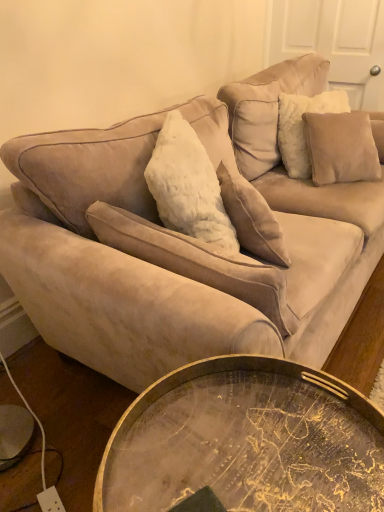
The image size is (384, 512). Describe the element at coordinates (303, 127) in the screenshot. I see `suede beige pillow at upper right, the second pillow from the right` at that location.

Locate an element on the screen. suede beige pillow at upper right, the second pillow viewed from the left is located at coordinates (303, 127).

Describe the element at coordinates (341, 147) in the screenshot. The width and height of the screenshot is (384, 512). I see `suede beige pillow at upper right, which is the 3th pillow from left to right` at that location.

Find the location of `suede beige couch at upper center`. suede beige couch at upper center is located at coordinates (188, 240).

At what (x,y) coordinates should I click in order to perform the action: click on gold metallic tray at lower center. Please return your answer as a coordinate pair (x, y). Looking at the image, I should click on (246, 441).

Does point (261, 211) come in front of point (234, 257)?

No, it is not.

Between white fluffy pillow at center, marked as the 1th pillow in a front-to-back arrangement, and suede beige couch at upper center, which one has less height?

Standing shorter between the two is white fluffy pillow at center, marked as the 1th pillow in a front-to-back arrangement.

Considering the positions of objects white fluffy pillow at center, the third pillow viewed from the back, and suede beige couch at upper center in the image provided, who is in front, white fluffy pillow at center, the third pillow viewed from the back, or suede beige couch at upper center?

suede beige couch at upper center is closer to the camera.

Is white fluffy pillow at center, the third pillow viewed from the back, turned away from suede beige couch at upper center?

Yes.

Does suede beige couch at upper center appear on the left side of gold metallic tray at lower center?

No.

Is suede beige couch at upper center aimed at gold metallic tray at lower center?

No, suede beige couch at upper center does not turn towards gold metallic tray at lower center.

How much distance is there between suede beige couch at upper center and gold metallic tray at lower center?

suede beige couch at upper center and gold metallic tray at lower center are 54.46 centimeters apart from each other.

From a real-world perspective, is suede beige couch at upper center positioned under gold metallic tray at lower center based on gravity?

No, from a real-world perspective, suede beige couch at upper center is not under gold metallic tray at lower center.

Based on the photo, from the image's perspective, is suede beige pillow at upper right, the second pillow viewed from the front, located above or below gold metallic tray at lower center?

Based on their image positions, suede beige pillow at upper right, the second pillow viewed from the front, is located above gold metallic tray at lower center.

Is suede beige pillow at upper right, the second pillow viewed from the front, not within gold metallic tray at lower center?

Yes, suede beige pillow at upper right, the second pillow viewed from the front, is outside of gold metallic tray at lower center.

From the picture: Between suede beige pillow at upper right, arranged as the second pillow when viewed from the back, and gold metallic tray at lower center, which one appears on the left side from the viewer's perspective?

From the viewer's perspective, gold metallic tray at lower center appears more on the left side.

Which is closer to the camera, (293, 172) or (114, 444)?

Point (293, 172) is farther from the camera than point (114, 444).

Is white fluffy pillow at center, acting as the 1th pillow starting from the left, placed right next to gold metallic tray at lower center?

No.

Which is more to the right, white fluffy pillow at center, the third pillow viewed from the back, or gold metallic tray at lower center?

white fluffy pillow at center, the third pillow viewed from the back.

Where is `coffee table below the white fluffy pillow at center, acting as the 1th pillow starting from the left (from a real-world perspective)`? This screenshot has width=384, height=512. coffee table below the white fluffy pillow at center, acting as the 1th pillow starting from the left (from a real-world perspective) is located at coordinates (246, 441).

Considering the relative sizes of white fluffy pillow at center, acting as the 1th pillow starting from the left, and gold metallic tray at lower center in the image provided, is white fluffy pillow at center, acting as the 1th pillow starting from the left, bigger than gold metallic tray at lower center?

No.

How far apart are gold metallic tray at lower center and suede beige pillow at upper right, which appears as the 3th pillow when viewed from the front?

gold metallic tray at lower center and suede beige pillow at upper right, which appears as the 3th pillow when viewed from the front, are 1.62 meters apart.

Which is closer to the camera, (205, 470) or (358, 131)?

Point (205, 470) is closer to the camera than point (358, 131).

Considering their positions, is gold metallic tray at lower center located in front of or behind suede beige pillow at upper right, which appears as the 3th pillow when viewed from the front?

Visually, gold metallic tray at lower center is located in front of suede beige pillow at upper right, which appears as the 3th pillow when viewed from the front.

Which pillow is the 2nd one when counting from the back of the suede beige couch at upper center? Please provide its 2D coordinates.

[(303, 127)]

Can we say suede beige pillow at upper right, the second pillow viewed from the left, lies outside suede beige couch at upper center?

No, suede beige pillow at upper right, the second pillow viewed from the left, is not entirely external to suede beige couch at upper center.

From the picture: Is suede beige pillow at upper right, the second pillow viewed from the front, positioned in front of suede beige couch at upper center?

No, suede beige pillow at upper right, the second pillow viewed from the front, is behind suede beige couch at upper center.

How many degrees apart are the facing directions of suede beige pillow at upper right, the second pillow from the right, and suede beige couch at upper center?

48.5 degrees separate the facing orientations of suede beige pillow at upper right, the second pillow from the right, and suede beige couch at upper center.

Is suede beige couch at upper center in front of white fluffy pillow at center, the third pillow viewed from the back?

Yes, suede beige couch at upper center is in front of white fluffy pillow at center, the third pillow viewed from the back.

At what (x,y) coordinates should I click in order to perform the action: click on studio couch below the white fluffy pillow at center, acting as the 1th pillow starting from the left (from a real-world perspective). Please return your answer as a coordinate pair (x, y). This screenshot has width=384, height=512. Looking at the image, I should click on (188, 240).

Could you measure the distance between suede beige couch at upper center and white fluffy pillow at center, the third pillow viewed from the back?

suede beige couch at upper center is 12.97 inches from white fluffy pillow at center, the third pillow viewed from the back.

In terms of size, does suede beige couch at upper center appear bigger or smaller than white fluffy pillow at center, which is counted as the 3th pillow, starting from the right?

In the image, suede beige couch at upper center appears to be larger than white fluffy pillow at center, which is counted as the 3th pillow, starting from the right.

I want to click on studio couch lying on the right of white fluffy pillow at center, which is counted as the 3th pillow, starting from the right, so click(x=188, y=240).

You are a GUI agent. You are given a task and a screenshot of the screen. Output one action in this format:
    pyautogui.click(x=<x>, y=<y>)
    Task: Click on the studio couch above the gold metallic tray at lower center (from the image's perspective)
    This screenshot has height=512, width=384.
    Given the screenshot: What is the action you would take?
    pyautogui.click(x=188, y=240)

Looking at the image, which one is located further to suede beige couch at upper center, suede beige pillow at upper right, arranged as the second pillow when viewed from the back, or gold metallic tray at lower center?

suede beige pillow at upper right, arranged as the second pillow when viewed from the back, is positioned further to the anchor suede beige couch at upper center.

Estimate the real-world distances between objects in this image. Which object is further from white fluffy pillow at center, the third pillow viewed from the back, suede beige pillow at upper right, the second pillow viewed from the left, or gold metallic tray at lower center?

suede beige pillow at upper right, the second pillow viewed from the left, is positioned further to the anchor white fluffy pillow at center, the third pillow viewed from the back.

Looking at the image, which one is located further to suede beige pillow at upper right, the second pillow viewed from the front, suede beige couch at upper center or gold metallic tray at lower center?

gold metallic tray at lower center is further to suede beige pillow at upper right, the second pillow viewed from the front.

Estimate the real-world distances between objects in this image. Which object is closer to suede beige pillow at upper right, which is the 3th pillow from left to right, suede beige pillow at upper right, the second pillow from the right, or gold metallic tray at lower center?

suede beige pillow at upper right, the second pillow from the right.

Which object lies nearer to the anchor point suede beige pillow at upper right, the second pillow from the right, gold metallic tray at lower center or suede beige pillow at upper right, which appears as the 3th pillow when viewed from the front?

suede beige pillow at upper right, which appears as the 3th pillow when viewed from the front, is closer to suede beige pillow at upper right, the second pillow from the right.

Estimate the real-world distances between objects in this image. Which object is further from suede beige couch at upper center, white fluffy pillow at center, the third pillow viewed from the back, or suede beige pillow at upper right, placed as the 1th pillow when sorted from right to left?

suede beige pillow at upper right, placed as the 1th pillow when sorted from right to left, lies further to suede beige couch at upper center than the other object.

Considering their positions, is suede beige pillow at upper right, which is the 3th pillow from left to right, positioned closer to gold metallic tray at lower center than suede beige pillow at upper right, arranged as the second pillow when viewed from the back?

suede beige pillow at upper right, which is the 3th pillow from left to right, is positioned closer to the anchor gold metallic tray at lower center.

From the image, which object appears to be nearer to gold metallic tray at lower center, white fluffy pillow at center, acting as the 1th pillow starting from the left, or suede beige pillow at upper right, which is the 3th pillow from left to right?

Among the two, white fluffy pillow at center, acting as the 1th pillow starting from the left, is located nearer to gold metallic tray at lower center.

At what (x,y) coordinates should I click in order to perform the action: click on pillow between suede beige couch at upper center and gold metallic tray at lower center in the vertical direction. Please return your answer as a coordinate pair (x, y). This screenshot has height=512, width=384. Looking at the image, I should click on (251, 216).

What are the coordinates of `studio couch between gold metallic tray at lower center and suede beige pillow at upper right, placed as the 1th pillow when sorted from right to left, from front to back` in the screenshot? It's located at (188, 240).

The image size is (384, 512). I want to click on pillow between suede beige couch at upper center and suede beige pillow at upper right, the second pillow from the right, from front to back, so click(x=251, y=216).

What are the coordinates of `pillow located between gold metallic tray at lower center and suede beige pillow at upper right, arranged as the second pillow when viewed from the back, in the depth direction` in the screenshot? It's located at (251, 216).